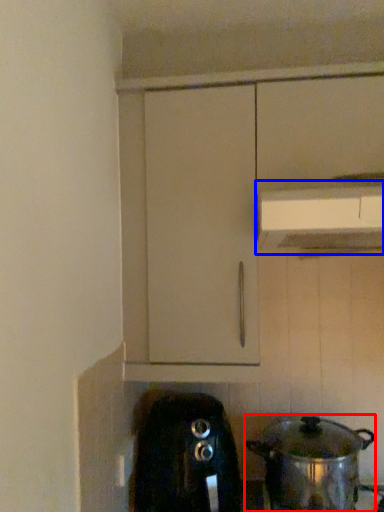
Question: Which object appears farthest to the camera in this image, kitchen appliance (highlighted by a red box) or vent (highlighted by a blue box)?

Choices:
 (A) kitchen appliance
 (B) vent

Answer: (A)